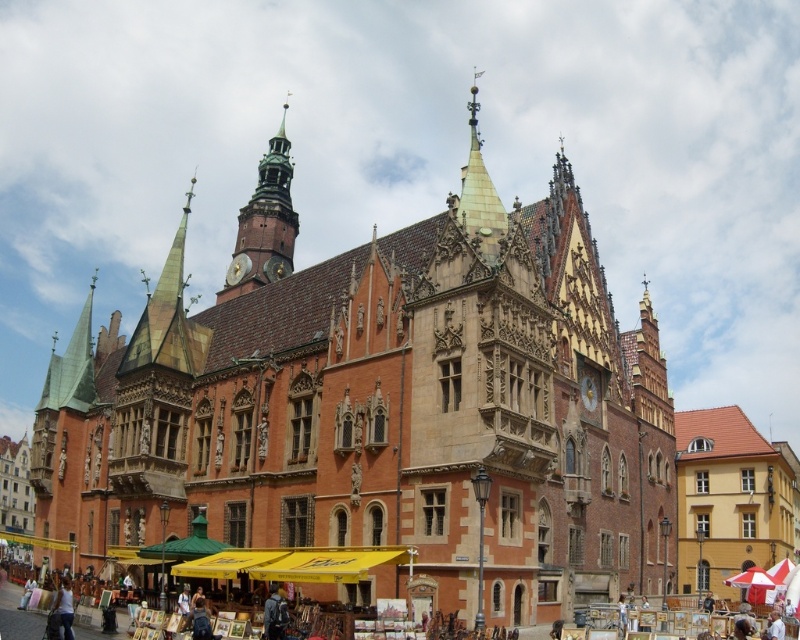
Question: In this image, where is matte brick church at center located relative to white cotton shirt at lower left?

Choices:
 (A) above
 (B) below

Answer: (A)

Question: Among these points, which one is nearest to the camera?

Choices:
 (A) (270, 628)
 (B) (572, 305)

Answer: (A)

Question: Considering the relative positions of yellow fabric canopy at lower center and dark gray fabric jacket at center in the image provided, where is yellow fabric canopy at lower center located with respect to dark gray fabric jacket at center?

Choices:
 (A) right
 (B) left

Answer: (A)

Question: Where is matte brick church at center located in relation to yellow fabric canopy at lower center in the image?

Choices:
 (A) left
 (B) right

Answer: (A)

Question: Which point is closer to the camera?

Choices:
 (A) white cotton shirt at lower left
 (B) yellow fabric canopy at lower center
 (C) polished wood clock tower at upper center

Answer: (A)

Question: Which of the following is the closest to the observer?

Choices:
 (A) matte brick church at center
 (B) polished wood clock tower at upper center

Answer: (A)